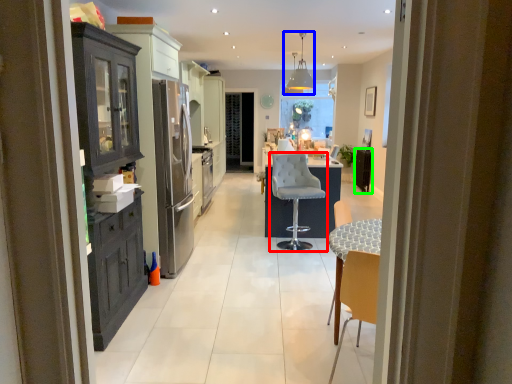
Question: Which object is positioned closest to chair (highlighted by a red box)? Select from light fixture (highlighted by a blue box) and appliance (highlighted by a green box).

Choices:
 (A) light fixture
 (B) appliance

Answer: (B)